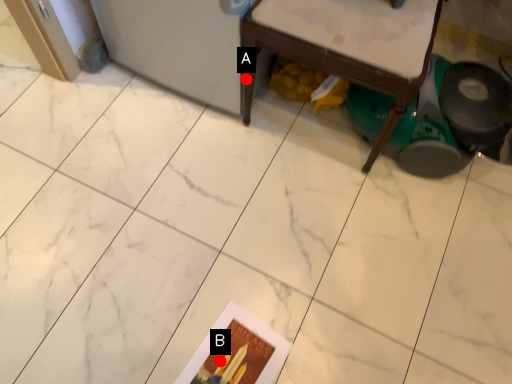
Question: Two points are circled on the image, labeled by A and B beside each circle. Which point is farther from the camera taking this photo?

Choices:
 (A) A is further
 (B) B is further

Answer: (A)